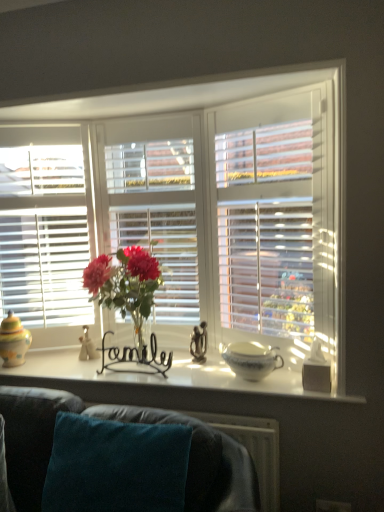
Locate an element on the screen. The image size is (384, 512). spots to the right of multicolored ceramic jar at left, arranged as the first candle holder when viewed from the back is located at coordinates (53, 366).